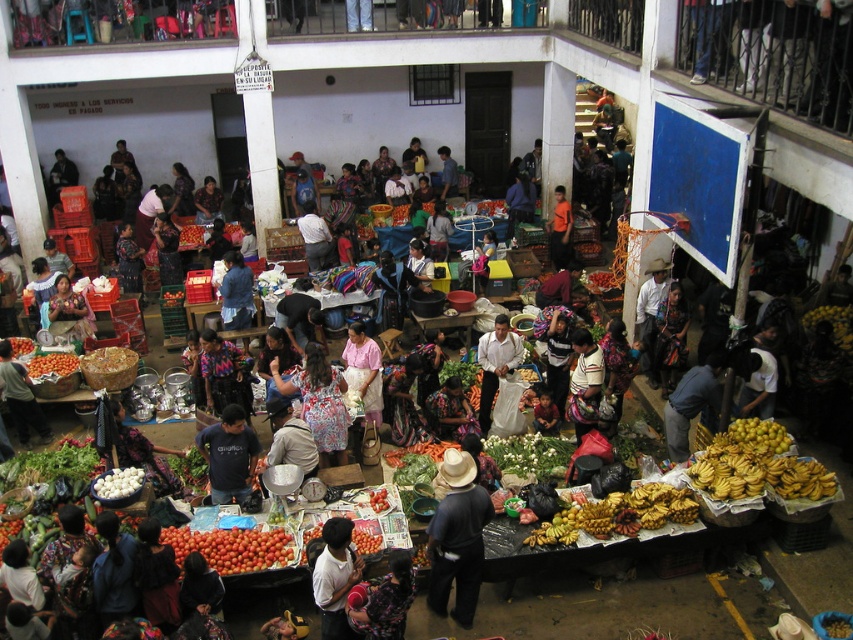
Can you confirm if white matte shirt at center is thinner than white fabric at center?

Indeed, white matte shirt at center has a lesser width compared to white fabric at center.

The image size is (853, 640). Describe the element at coordinates (335, 577) in the screenshot. I see `white matte shirt at center` at that location.

The height and width of the screenshot is (640, 853). In order to click on white matte shirt at center in this screenshot , I will do `click(335, 577)`.

Where is `white matte shirt at center`? The image size is (853, 640). white matte shirt at center is located at coordinates (335, 577).

Is ripe red tomatoes at lower center to the left of denim jacket at center from the viewer's perspective?

Incorrect, ripe red tomatoes at lower center is not on the left side of denim jacket at center.

Can you confirm if ripe red tomatoes at lower center is wider than denim jacket at center?

Yes.

Where is `ripe red tomatoes at lower center`? ripe red tomatoes at lower center is located at coordinates (231, 547).

The width and height of the screenshot is (853, 640). Find the location of `ripe red tomatoes at lower center`. ripe red tomatoes at lower center is located at coordinates tap(231, 547).

What do you see at coordinates (457, 538) in the screenshot?
I see `dark blue fabric at center` at bounding box center [457, 538].

Is point (447, 515) closer to viewer compared to point (244, 321)?

Yes, point (447, 515) is closer to viewer.

Locate an element on the screen. dark blue fabric at center is located at coordinates (457, 538).